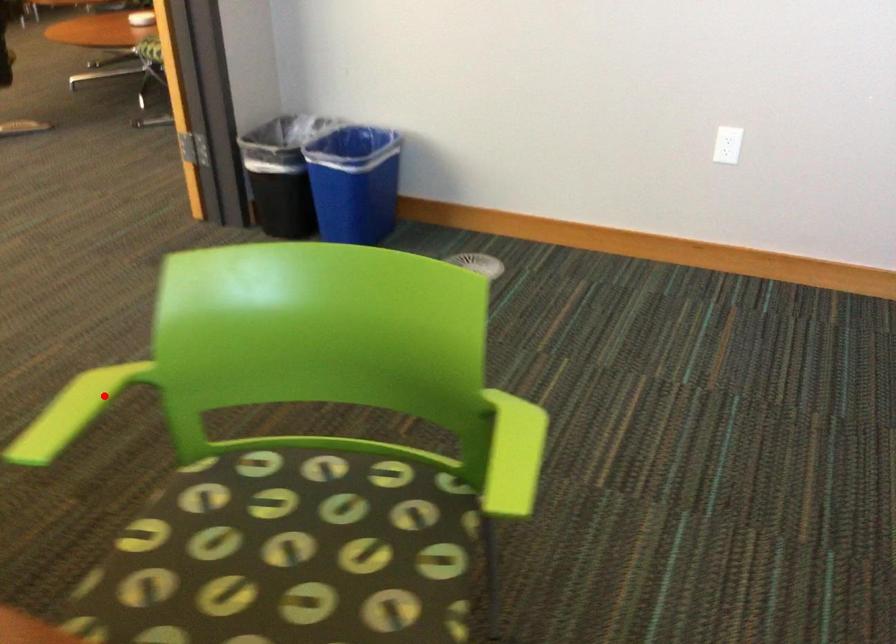
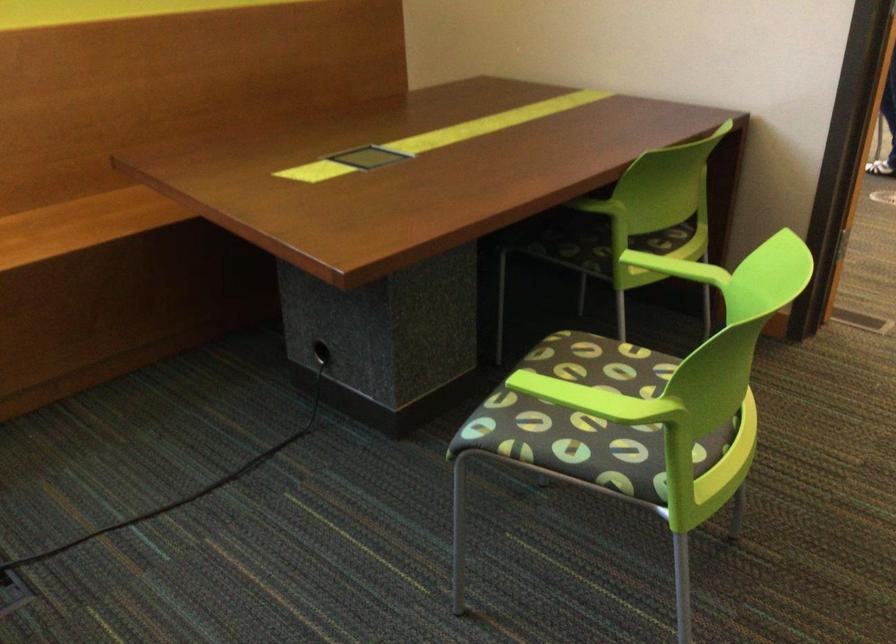
In the second image, find the point that corresponds to the highlighted location in the first image.

(676, 268)